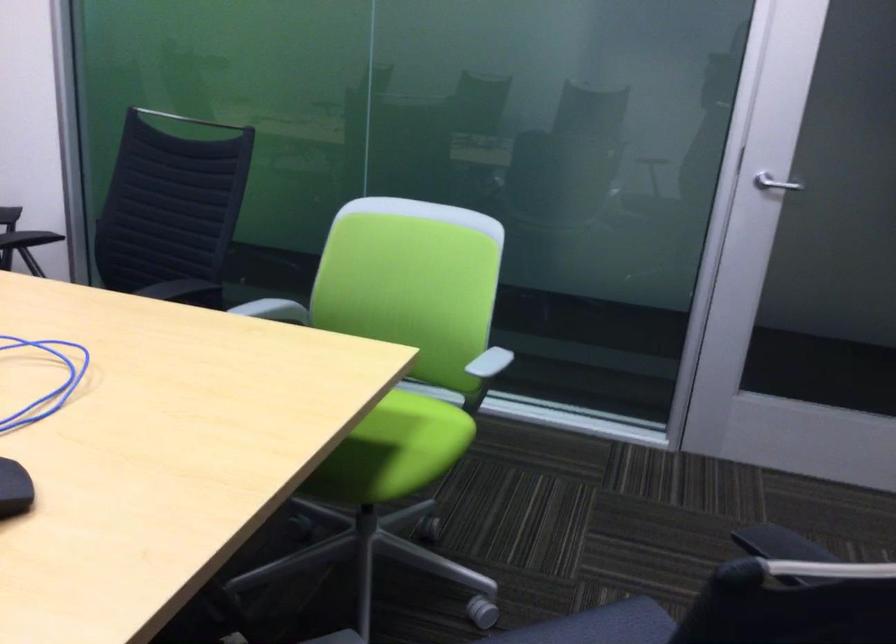
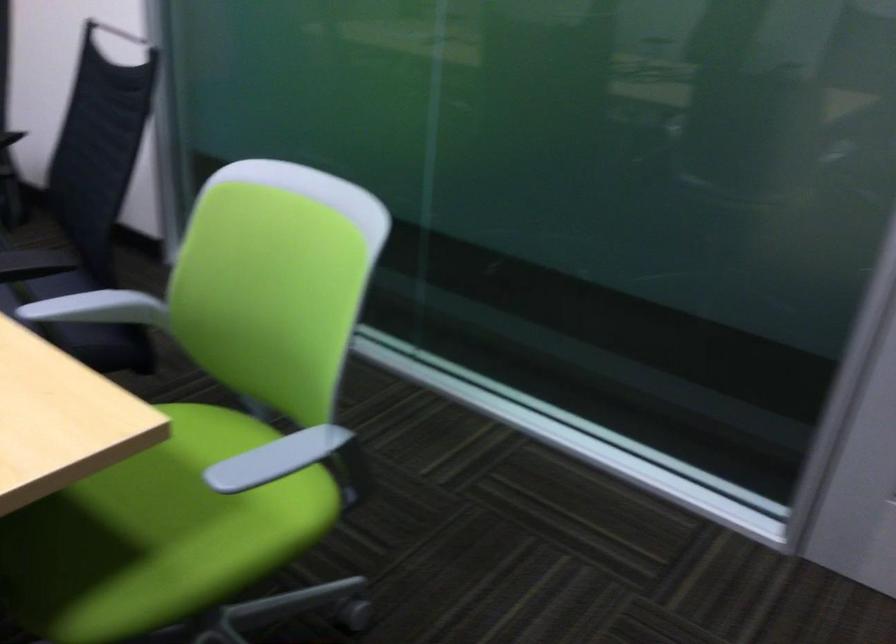
Find the pixel in the second image that matches point (489, 361) in the first image.

(276, 458)